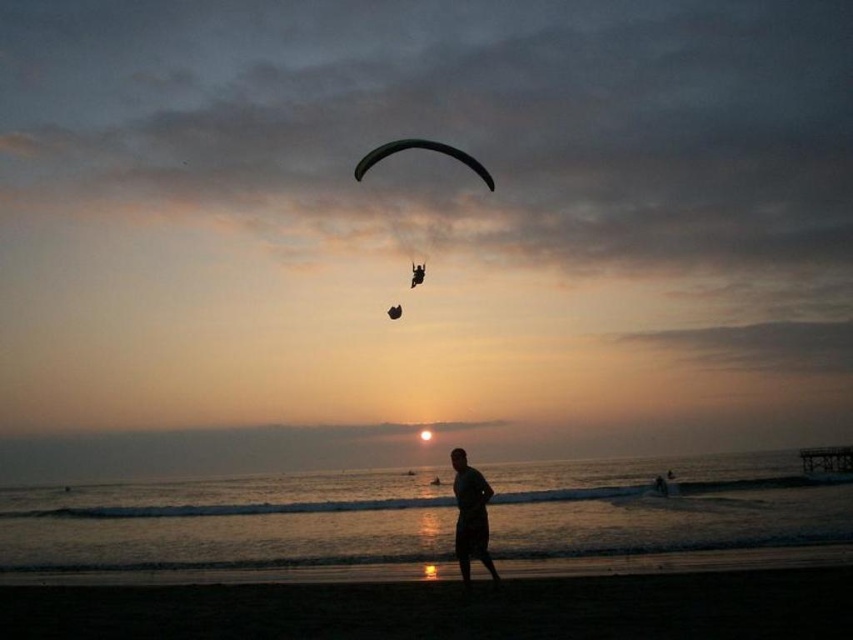
Find the location of `silhouette cotton shorts at center`. silhouette cotton shorts at center is located at coordinates (469, 515).

Does silhouette cotton shorts at center appear on the right side of green fabric parachute at upper center?

Indeed, silhouette cotton shorts at center is positioned on the right side of green fabric parachute at upper center.

Where is `silhouette cotton shorts at center`? silhouette cotton shorts at center is located at coordinates (469, 515).

Identify the location of silhouette cotton shorts at center. (469, 515).